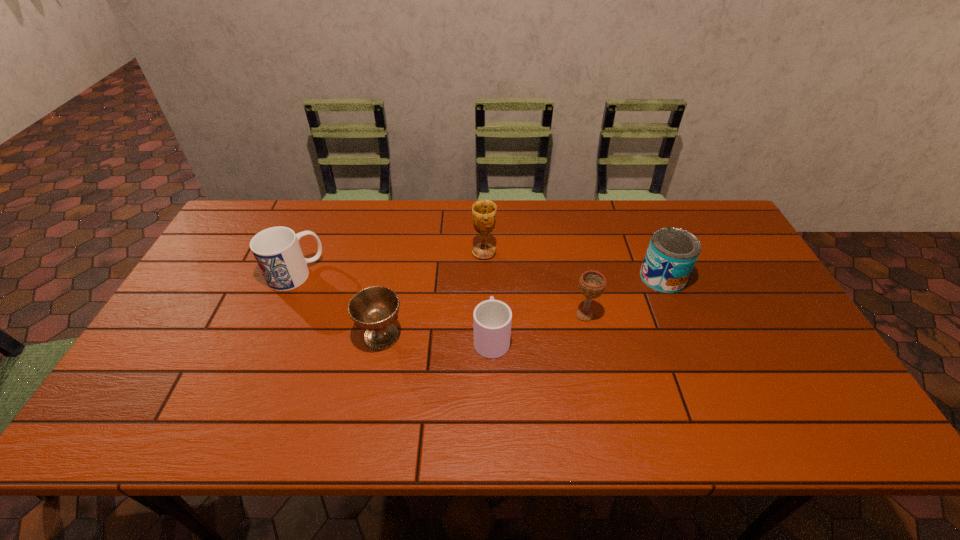
The image size is (960, 540). Identify the location of the farthest chalice. (483, 211).

Locate an element on the screen. Image resolution: width=960 pixels, height=540 pixels. the tallest chalice is located at coordinates (483, 211).

Locate an element on the screen. the leftmost object is located at coordinates (277, 251).

This screenshot has width=960, height=540. In order to click on the second object from right to left in this screenshot , I will do `click(592, 283)`.

The width and height of the screenshot is (960, 540). What are the coordinates of `can` in the screenshot? It's located at (672, 253).

Where is `the fifth object from right to left`? The height and width of the screenshot is (540, 960). the fifth object from right to left is located at coordinates [375, 308].

Where is `cup`? This screenshot has height=540, width=960. cup is located at coordinates (492, 319).

Locate an element on the screen. The image size is (960, 540). vacant area located on the front of the farthest chalice is located at coordinates (485, 318).

Find the location of a particular element. This screenshot has width=960, height=540. blank area located on the right of the leftmost object is located at coordinates (449, 274).

Locate an element on the screen. vacant point located on the front of the second object from right to left is located at coordinates (596, 369).